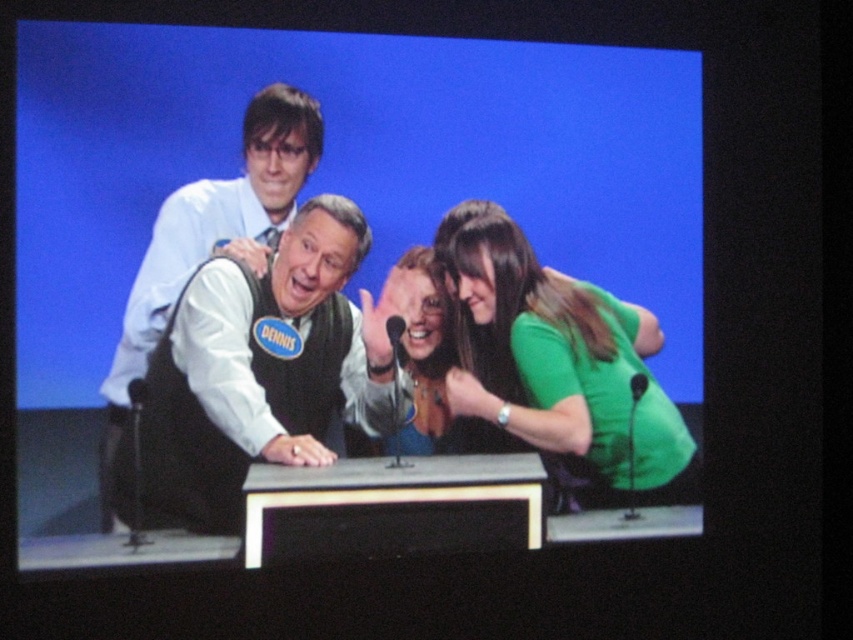
You are a stagehand setting up for a game show. You need to place a 3ft wide banner behind the podium. The banner must not cover any of the participants. Given that the matte black podium at center is larger than the green matte shirt at right, can you safely place the banner behind the podium without covering the participants?

The matte black podium at center has a larger size compared to the green matte shirt at right. Since the podium is larger, placing a 3ft wide banner behind it would likely not cover the participants, as the podium provides sufficient space. However, ensure the banner is positioned centrally behind the podium to avoid covering anyone.

You are a stagehand setting up a camera on the left side of the stage. You need to ensure that the camera can capture both the green matte shirt at right and the matte green dress at center. Based on their positions, which object is lower in the frame?

The green matte shirt at right is positioned below the matte green dress at center, so the green matte shirt at right will appear lower in the frame.

You are a costume designer reviewing the show setup. You need to ensure that the green matte shirt at right and the matte green dress at center are appropriately sized for their wearers. Based on the scene description, which item is larger?

The green matte shirt at right is larger in size than the matte green dress at center.